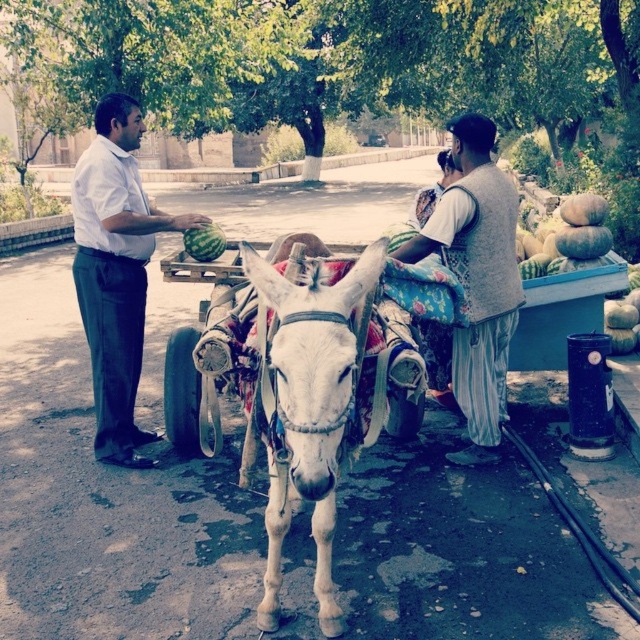
You are a traveler standing on the side of the road and see the white shirt at left and the green textured pumpkins at right in the cart. Which object is taller?

The white shirt at left is taller than the green textured pumpkins at right.

You are standing on the road and see two points marked in the scene. Which point is closer to you, point (134, 131) or point (504, 332)?

Point (134, 131) is closer to you because it is further to the viewer than point (504, 332).

You are a delivery person standing next to the cart and need to place a package between the white shirt at left and the green textured pumpkins at right. Can you fit the package in the space between them?

The white shirt at left might be wider than green textured pumpkins at right, so the space between them may not be sufficient for the package. Check the exact width before placing it.